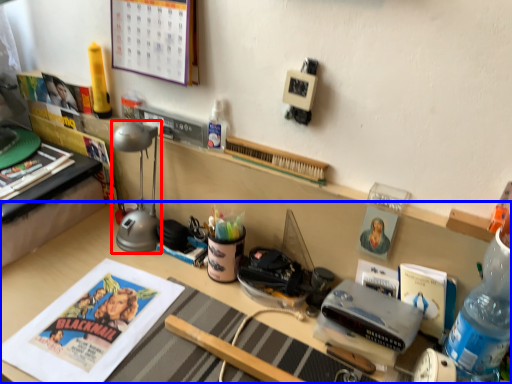
Question: Which point is further to the camera, table lamp (highlighted by a red box) or desk (highlighted by a blue box)?

Choices:
 (A) table lamp
 (B) desk

Answer: (A)